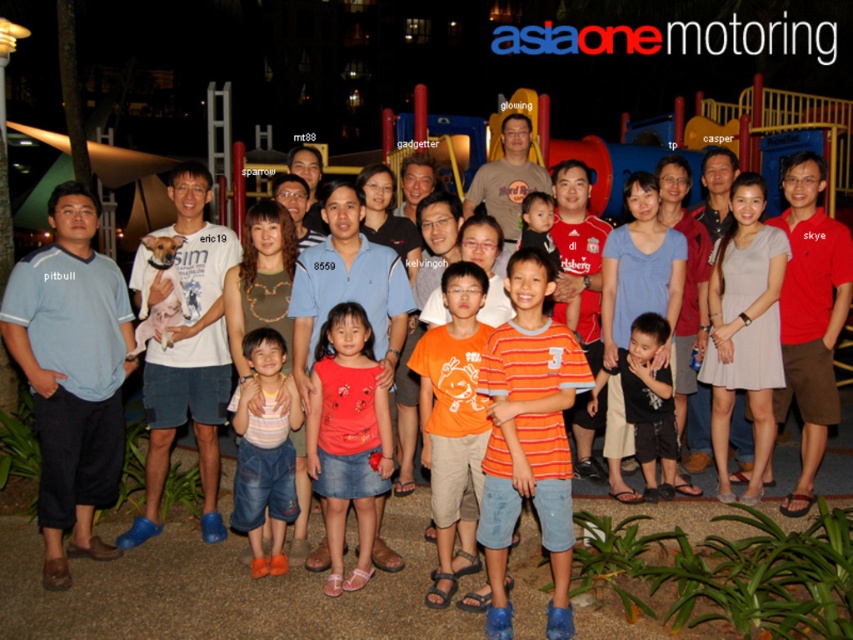
Consider the image. You are taking a group photo at night in a playground. You notice two people wearing orange cotton shirt at center and black cotton shirt at center. Which one is positioned lower in the photo?

The orange cotton shirt at center is positioned below the black cotton shirt at center, so the orange cotton shirt at center is lower in the photo.

You are a photographer trying to adjust the lighting for a group photo. You notice two people in the front row wearing shirts labeled as striped cotton shirt at center and black cotton shirt at center. Which shirt should you focus on to ensure the taller person is properly lit?

The striped cotton shirt at center is taller than the black cotton shirt at center, so you should focus on the striped cotton shirt at center to ensure the taller person is properly lit.